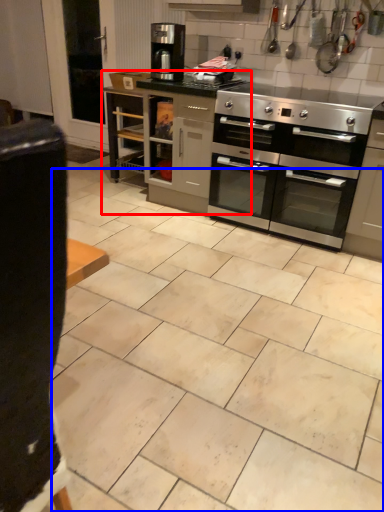
Question: Which of the following is the farthest to the observer, cabinetry (highlighted by a red box) or ceramic tile (highlighted by a blue box)?

Choices:
 (A) cabinetry
 (B) ceramic tile

Answer: (A)